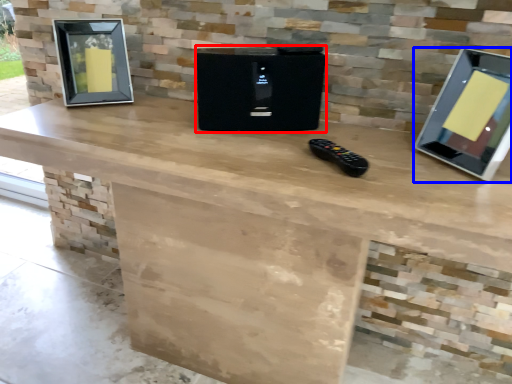
Question: Which object appears farthest to the camera in this image, appliance (highlighted by a red box) or computer monitor (highlighted by a blue box)?

Choices:
 (A) appliance
 (B) computer monitor

Answer: (A)